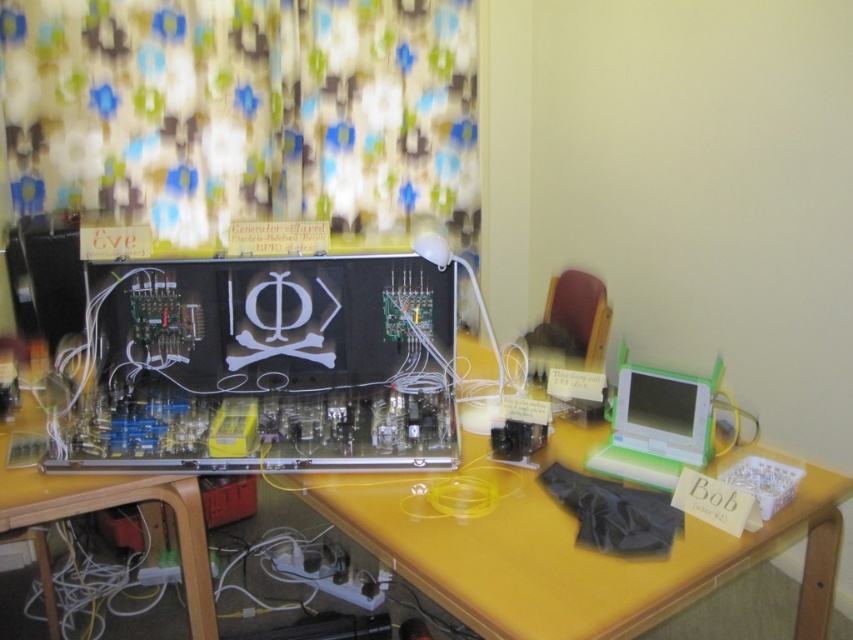
You are organizing a small party in the room where the image is taken. You need to hang a decoration that requires a large surface area. Which object between the floral fabric curtain at upper left and the yellow plastic computer desk at center would be more suitable for hanging the decoration?

The floral fabric curtain at upper left is bigger than the yellow plastic computer desk at center, so it would be more suitable for hanging the decoration that requires a large surface area.

You are organizing a small party in this workspace and need to move the yellow plastic computer desk at center closer to the entrance. However, you notice the floral fabric curtain at upper left might block the path. Based on their positions, can you move the desk without removing the curtain?

The floral fabric curtain at upper left is further to the viewer than yellow plastic computer desk at center, so moving the desk closer to the entrance would require moving it forward, which is behind the curtain. Therefore, the desk can be moved without removing the curtain as it is positioned behind it.

Where is the matte black circuit board at center located in the image?

The matte black circuit board at center is located at point 0.573 on the x axis and 0.311 on the y axis.